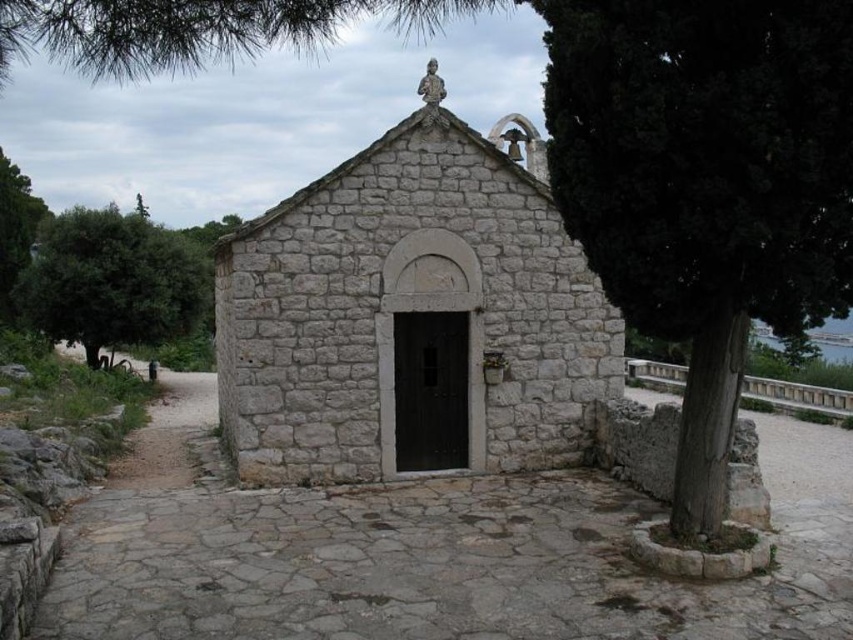
Question: Can you confirm if gray stone church at center is positioned to the right of green leafy tree at left?

Choices:
 (A) no
 (B) yes

Answer: (B)

Question: Estimate the real-world distances between objects in this image. Which object is farther from the gray stone church at center?

Choices:
 (A) green leafy tree at left
 (B) gray stone path at center

Answer: (A)

Question: Which point is farther to the camera?

Choices:
 (A) (73, 515)
 (B) (132, 256)

Answer: (B)

Question: Does gray stone path at center have a greater width compared to gray stone church at center?

Choices:
 (A) yes
 (B) no

Answer: (A)

Question: Which of the following is the closest to the observer?

Choices:
 (A) green leafy tree at left
 (B) gray stone church at center
 (C) gray stone path at center

Answer: (C)

Question: Does gray stone path at center appear over green leafy tree at left?

Choices:
 (A) no
 (B) yes

Answer: (A)